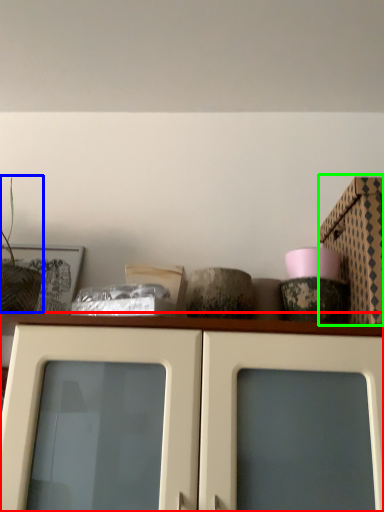
Question: Which is farther away from cabinetry (highlighted by a red box)? plant (highlighted by a blue box) or cardboard box (highlighted by a green box)?

Choices:
 (A) plant
 (B) cardboard box

Answer: (A)